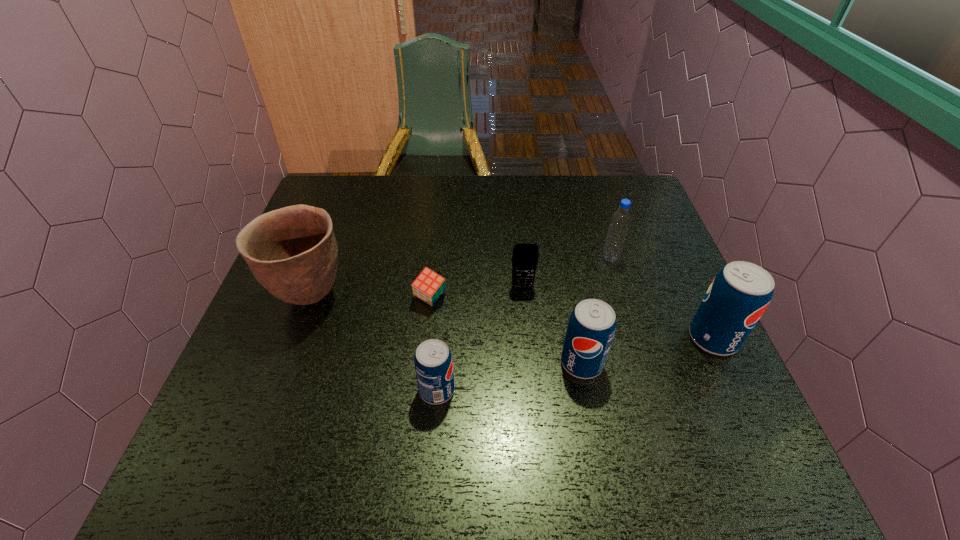
In order to click on vacant region that satisfies the following two spatial constraints: 1. on the screen of the second tallest pop; 2. on the left side of the fourth object from right to left in this screenshot , I will do `click(530, 363)`.